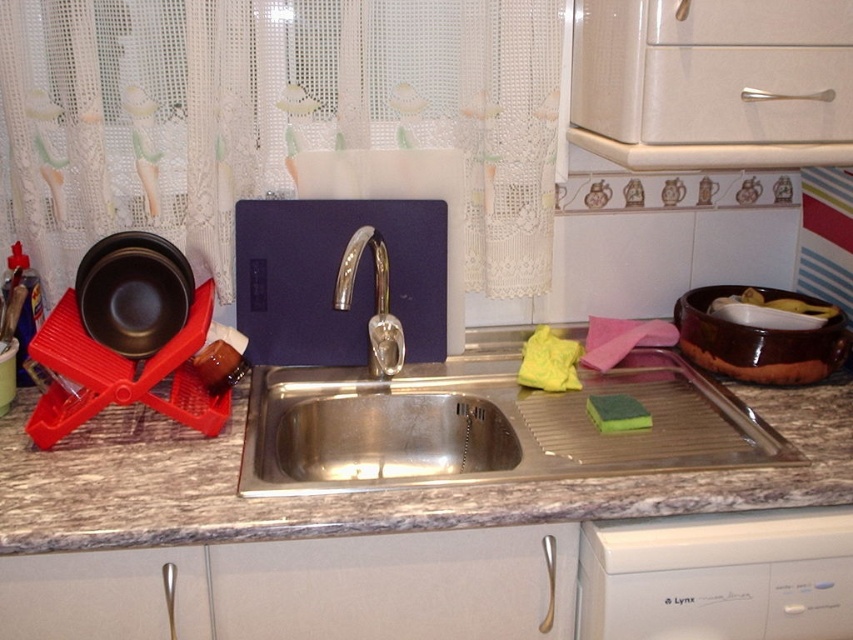
You are organizing the kitchen and need to place a new dish rack between the white plastic dishwasher at lower right and the polished chrome faucet at center. According to the scene description, where should you position the new dish rack?

The white plastic dishwasher at lower right is on the right side of the polished chrome faucet at center, so the new dish rack should be placed between them, to the right of the faucet and left of the dishwasher.